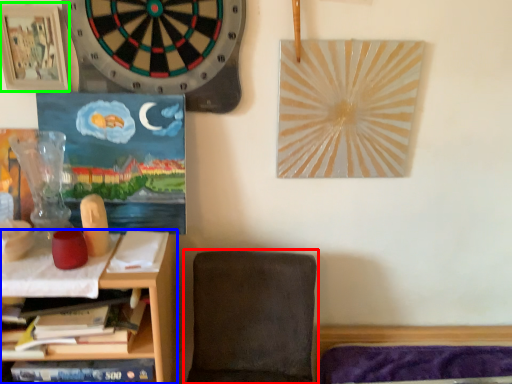
Question: Which is farther away from chair (highlighted by a red box)? shelf (highlighted by a blue box) or picture frame (highlighted by a green box)?

Choices:
 (A) shelf
 (B) picture frame

Answer: (B)